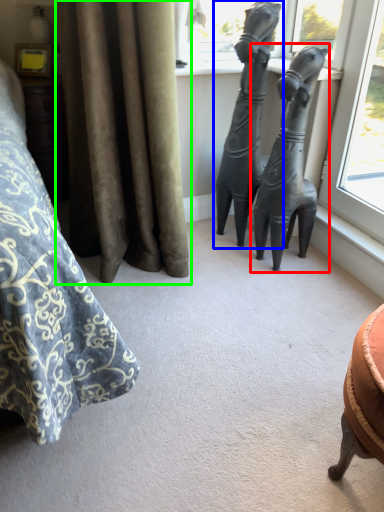
Question: Which object is positioned closest to statue (sculpture) (highlighted by a red box)? Select from statue (sculpture) (highlighted by a blue box) and curtain (highlighted by a green box).

Choices:
 (A) statue (sculpture)
 (B) curtain

Answer: (A)